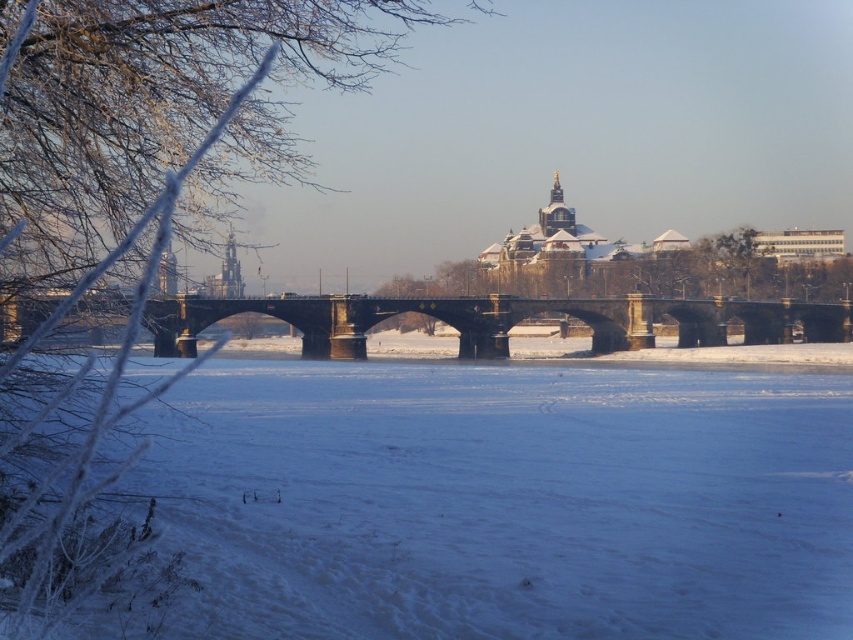
Does white powdery snow at center have a greater height compared to stone bridge at center?

In fact, white powdery snow at center may be shorter than stone bridge at center.

Who is higher up, white powdery snow at center or stone bridge at center?

stone bridge at center is above.

Is point (262, 502) less distant than point (438, 312)?

That is True.

The height and width of the screenshot is (640, 853). I want to click on white powdery snow at center, so click(505, 500).